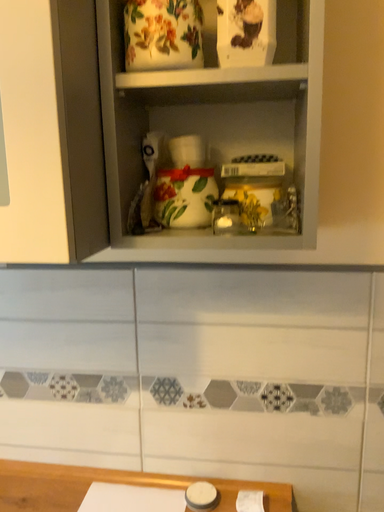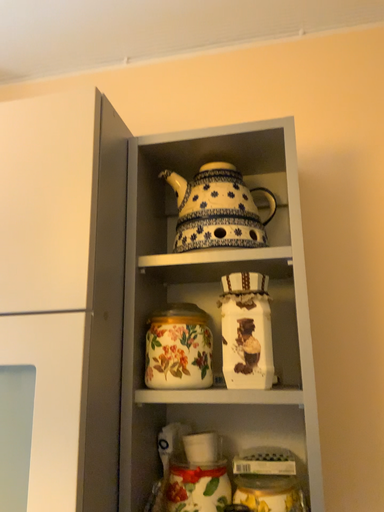
Question: How did the camera likely rotate when shooting the video?

Choices:
 (A) rotated downward
 (B) rotated upward

Answer: (B)